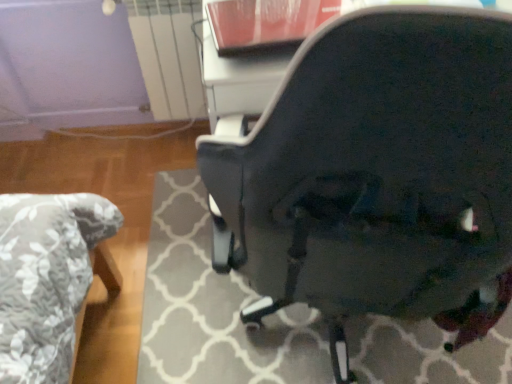
Question: Should I look upward or downward to see glossy black chair at center?

Choices:
 (A) up
 (B) down

Answer: (A)